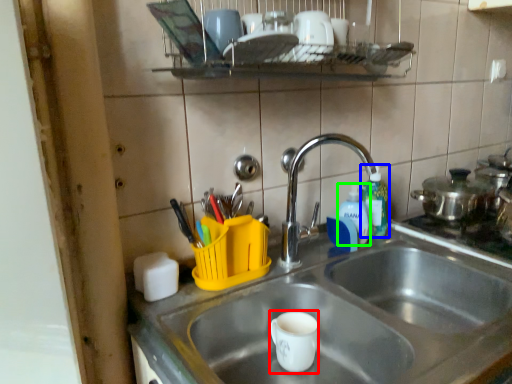
Question: Based on their relative distances, which object is farther from mug (highlighted by a red box)? Choose from bottle (highlighted by a blue box) and bottle (highlighted by a green box).

Choices:
 (A) bottle
 (B) bottle

Answer: (A)